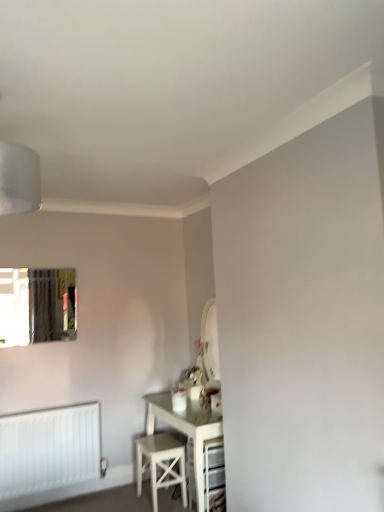
Describe the element at coordinates (161, 464) in the screenshot. I see `white wood stool at lower center` at that location.

You are a GUI agent. You are given a task and a screenshot of the screen. Output one action in this format:
    pyautogui.click(x=<x>, y=<y>)
    Task: Click on the clear glass mirror at upper left
    The width and height of the screenshot is (384, 512).
    Given the screenshot: What is the action you would take?
    pyautogui.click(x=37, y=305)

Is clear glass mirror at upper left next to white wood stool at lower center?

No.

Image resolution: width=384 pixels, height=512 pixels. Find the location of `stool below the clear glass mirror at upper left (from the image's perspective)`. stool below the clear glass mirror at upper left (from the image's perspective) is located at coordinates (161, 464).

Measure the distance between clear glass mirror at upper left and white wood stool at lower center.

clear glass mirror at upper left and white wood stool at lower center are 4.35 feet apart.

In the image, there is a white matte radiator at lower left. Identify the location of stool below it (from a real-world perspective). The width and height of the screenshot is (384, 512). (161, 464).

From the image's perspective, is white matte radiator at lower left beneath white wood stool at lower center?

No, from the image's perspective, white matte radiator at lower left is not beneath white wood stool at lower center.

Is white matte radiator at lower left oriented away from white wood stool at lower center?

No.

Considering the sizes of objects white matte radiator at lower left and white wood stool at lower center in the image provided, who is thinner, white matte radiator at lower left or white wood stool at lower center?

Thinner between the two is white matte radiator at lower left.

From the picture: How much distance is there between clear glass mirror at upper left and white matte radiator at lower left?

A distance of 32.87 inches exists between clear glass mirror at upper left and white matte radiator at lower left.

Are clear glass mirror at upper left and white matte radiator at lower left beside each other?

clear glass mirror at upper left is not next to white matte radiator at lower left, and they're not touching.

The image size is (384, 512). What are the coordinates of `window above the white matte radiator at lower left (from a real-world perspective)` in the screenshot? It's located at (37, 305).

Can you confirm if clear glass mirror at upper left is shorter than white matte radiator at lower left?

Yes.

Where is `window located behind the white wood stool at lower center`? This screenshot has height=512, width=384. window located behind the white wood stool at lower center is located at coordinates (37, 305).

Which object is positioned more to the right, white wood stool at lower center or clear glass mirror at upper left?

From the viewer's perspective, white wood stool at lower center appears more on the right side.

From the image's perspective, who appears lower, white wood stool at lower center or clear glass mirror at upper left?

white wood stool at lower center.

Is there a large distance between white wood stool at lower center and clear glass mirror at upper left?

Absolutely, white wood stool at lower center is distant from clear glass mirror at upper left.

From the image's perspective, is white matte radiator at lower left located above clear glass mirror at upper left?

Incorrect, from the image's perspective, white matte radiator at lower left is lower than clear glass mirror at upper left.

Considering their positions, is white matte radiator at lower left located in front of or behind clear glass mirror at upper left?

Visually, white matte radiator at lower left is located in front of clear glass mirror at upper left.

Does white matte radiator at lower left have a smaller size compared to clear glass mirror at upper left?

No.

Which object is wider, white matte radiator at lower left or clear glass mirror at upper left?

white matte radiator at lower left is wider.

Would you say white wood stool at lower center is a long distance from white matte radiator at lower left?

They are positioned close to each other.

Is white wood stool at lower center inside the boundaries of white matte radiator at lower left, or outside?

white wood stool at lower center is spatially situated outside white matte radiator at lower left.

From a real-world perspective, is white wood stool at lower center on top of white matte radiator at lower left?

No, from a real-world perspective, white wood stool at lower center is not on top of white matte radiator at lower left.

From the image's perspective, between white wood stool at lower center and white matte radiator at lower left, which one is located above?

From the image's view, white matte radiator at lower left is above.

In the image, there is a clear glass mirror at upper left. At what (x,y) coordinates should I click in order to perform the action: click on stool below it (from a real-world perspective). Please return your answer as a coordinate pair (x, y). The image size is (384, 512). Looking at the image, I should click on (161, 464).

Find the location of a particular element. radiator that appears behind the white wood stool at lower center is located at coordinates point(49,449).

Based on their spatial positions, is clear glass mirror at upper left or white wood stool at lower center closer to white matte radiator at lower left?

white wood stool at lower center lies closer to white matte radiator at lower left than the other object.

Considering their positions, is white matte radiator at lower left positioned closer to white wood stool at lower center than clear glass mirror at upper left?

white matte radiator at lower left is positioned closer to the anchor white wood stool at lower center.

From the image, which object appears to be farther from clear glass mirror at upper left, white matte radiator at lower left or white wood stool at lower center?

white wood stool at lower center is further to clear glass mirror at upper left.

Considering their positions, is white wood stool at lower center positioned closer to white matte radiator at lower left than clear glass mirror at upper left?

white wood stool at lower center is positioned closer to the anchor white matte radiator at lower left.

Which object lies nearer to the anchor point clear glass mirror at upper left, white wood stool at lower center or white matte radiator at lower left?

Among the two, white matte radiator at lower left is located nearer to clear glass mirror at upper left.

Which object lies further to the anchor point white wood stool at lower center, clear glass mirror at upper left or white matte radiator at lower left?

clear glass mirror at upper left lies further to white wood stool at lower center than the other object.

The image size is (384, 512). Identify the location of radiator between clear glass mirror at upper left and white wood stool at lower center in the up-down direction. (49, 449).